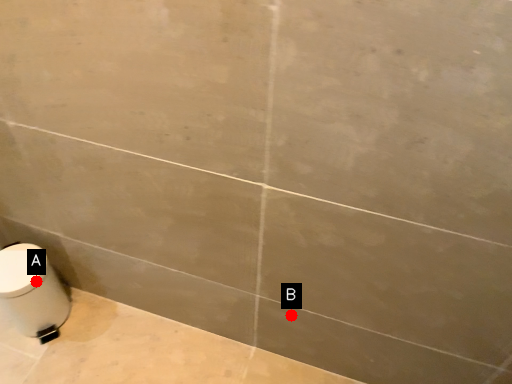
Question: Two points are circled on the image, labeled by A and B beside each circle. Among these points, which one is farthest from the camera?

Choices:
 (A) A is further
 (B) B is further

Answer: (A)